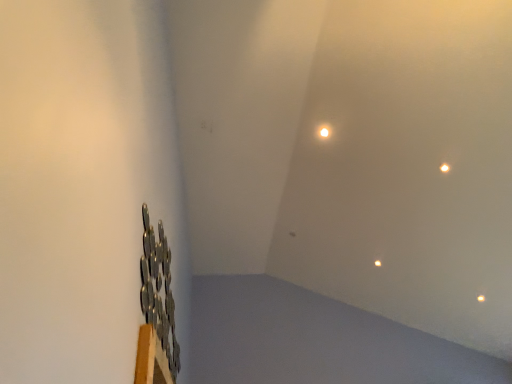
The image size is (512, 384). What do you see at coordinates (481, 298) in the screenshot? I see `matte white dot at upper right` at bounding box center [481, 298].

You are a GUI agent. You are given a task and a screenshot of the screen. Output one action in this format:
    pyautogui.click(x=<x>, y=<y>)
    Task: Click on the matte white dot at upper right
    The height and width of the screenshot is (384, 512).
    Given the screenshot: What is the action you would take?
    pyautogui.click(x=481, y=298)

Locate an element on the screen. The image size is (512, 384). matte white dot at upper right is located at coordinates (481, 298).